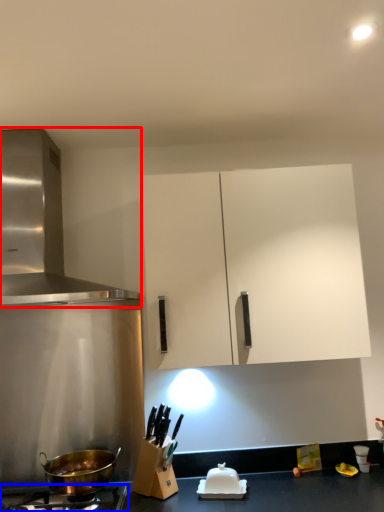
Question: Which of the following is the farthest to the observer, kitchen appliance (highlighted by a red box) or gas stove (highlighted by a blue box)?

Choices:
 (A) kitchen appliance
 (B) gas stove

Answer: (A)